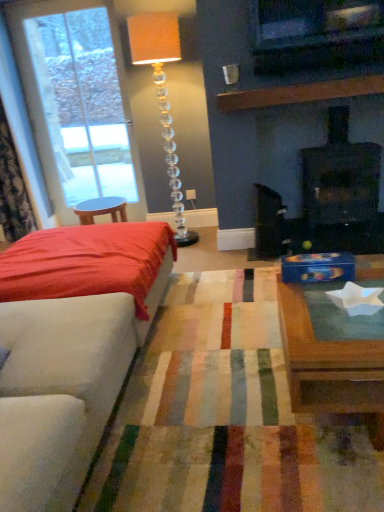
The image size is (384, 512). Describe the element at coordinates (162, 96) in the screenshot. I see `translucent crystal floor lamp at center` at that location.

I want to click on black matte fireplace at upper right, so click(x=340, y=176).

Who is smaller, black matte fireplace at upper right or wooden coffee table at center?

With smaller size is black matte fireplace at upper right.

From a real-world perspective, is black matte fireplace at upper right physically located above or below wooden coffee table at center?

black matte fireplace at upper right is above wooden coffee table at center.

Which is more to the right, black matte fireplace at upper right or wooden coffee table at center?

Positioned to the right is black matte fireplace at upper right.

Considering the positions of objects black matte fireplace at upper right and wooden coffee table at center in the image provided, who is in front, black matte fireplace at upper right or wooden coffee table at center?

Positioned in front is wooden coffee table at center.

Is point (53, 186) closer or farther from the camera than point (25, 115)?

Point (53, 186) is farther from the camera than point (25, 115).

From their relative heights in the image, would you say clear glass door at left is taller or shorter than velvet floral curtain at left?

Clearly, clear glass door at left is taller compared to velvet floral curtain at left.

The height and width of the screenshot is (512, 384). Find the location of `window above the velvet floral curtain at left (from a real-world perspective)`. window above the velvet floral curtain at left (from a real-world perspective) is located at coordinates (80, 102).

In terms of size, does clear glass door at left appear bigger or smaller than velvet floral curtain at left?

Considering their sizes, clear glass door at left takes up less space than velvet floral curtain at left.

Is clear glass door at left behind satin red bed at left?

Yes, clear glass door at left is behind satin red bed at left.

From the image's perspective, is clear glass door at left located above or below satin red bed at left?

Based on their image positions, clear glass door at left is located above satin red bed at left.

Considering the relative sizes of clear glass door at left and satin red bed at left in the image provided, is clear glass door at left taller than satin red bed at left?

Indeed, clear glass door at left has a greater height compared to satin red bed at left.

Is satin red bed at left far away from velvet floral curtain at left?

Yes, satin red bed at left is far from velvet floral curtain at left.

Between satin red bed at left and velvet floral curtain at left, which one is positioned behind?

velvet floral curtain at left.

Which is more distant, (145, 318) or (22, 115)?

The point (22, 115) is more distant.

From a real-world perspective, is satin red bed at left under velvet floral curtain at left?

Yes, from a real-world perspective, satin red bed at left is beneath velvet floral curtain at left.

Is point (208, 289) positioned in front of point (146, 327)?

No.

Which object is further away from the camera, wooden coffee table at center or satin red bed at left?

Positioned behind is satin red bed at left.

From the image's perspective, between wooden coffee table at center and satin red bed at left, which one is located above?

From the image's view, satin red bed at left is above.

Measure the distance between translucent crystal floor lamp at center and satin red bed at left.

They are 3.84 feet apart.

Considering the positions of point (192, 233) and point (2, 257), is point (192, 233) closer or farther from the camera than point (2, 257)?

Point (192, 233) is farther from the camera than point (2, 257).

Locate an element on the screen. The height and width of the screenshot is (512, 384). bed that appears on the left of translucent crystal floor lamp at center is located at coordinates (89, 263).

Can you confirm if translucent crystal floor lamp at center is thinner than satin red bed at left?

Yes.

From the image's perspective, who appears lower, translucent crystal floor lamp at center or velvet floral curtain at left?

From the image's view, translucent crystal floor lamp at center is below.

From a real-world perspective, is translucent crystal floor lamp at center on top of velvet floral curtain at left?

Actually, translucent crystal floor lamp at center is physically below velvet floral curtain at left in the real world.

Considering the relative positions of translucent crystal floor lamp at center and velvet floral curtain at left in the image provided, is translucent crystal floor lamp at center to the left or to the right of velvet floral curtain at left?

Clearly, translucent crystal floor lamp at center is on the right of velvet floral curtain at left in the image.

How different are the orientations of translucent crystal floor lamp at center and velvet floral curtain at left in degrees?

The facing directions of translucent crystal floor lamp at center and velvet floral curtain at left are 0.684 degrees apart.

The height and width of the screenshot is (512, 384). Identify the location of plain in front of the black matte fireplace at upper right. (225, 416).

The height and width of the screenshot is (512, 384). I want to click on curtain located underneath the clear glass door at left (from a real-world perspective), so tap(23, 133).

Looking at the image, which one is located further to translucent crystal floor lamp at center, satin red bed at left or velvet floral curtain at left?

Among the two, velvet floral curtain at left is located further to translucent crystal floor lamp at center.

When comparing their distances from velvet floral curtain at left, does wooden coffee table at center or translucent crystal floor lamp at center seem further?

The object further to velvet floral curtain at left is wooden coffee table at center.

Considering their positions, is velvet floral curtain at left positioned closer to wooden coffee table at center than satin red bed at left?

satin red bed at left.

Looking at the image, which one is located closer to velvet floral curtain at left, translucent crystal floor lamp at center or satin red bed at left?

translucent crystal floor lamp at center is positioned closer to the anchor velvet floral curtain at left.

In the scene shown: From the image, which object appears to be nearer to black matte fireplace at upper right, satin red bed at left or velvet floral curtain at left?

Based on the image, satin red bed at left appears to be nearer to black matte fireplace at upper right.

Which object lies nearer to the anchor point satin red bed at left, black matte fireplace at upper right or translucent crystal floor lamp at center?

The object closer to satin red bed at left is translucent crystal floor lamp at center.

Based on their spatial positions, is clear glass door at left or black matte fireplace at upper right closer to translucent crystal floor lamp at center?

clear glass door at left is positioned closer to the anchor translucent crystal floor lamp at center.

Looking at the image, which one is located further to clear glass door at left, wooden coffee table at center or velvet floral curtain at left?

Among the two, wooden coffee table at center is located further to clear glass door at left.

The width and height of the screenshot is (384, 512). I want to click on curtain between wooden coffee table at center and clear glass door at left along the z-axis, so click(x=23, y=133).

Where is `table lamp positioned between wooden coffee table at center and black matte fireplace at upper right from near to far`? The height and width of the screenshot is (512, 384). table lamp positioned between wooden coffee table at center and black matte fireplace at upper right from near to far is located at coordinates (162, 96).

In order to click on table lamp between satin red bed at left and clear glass door at left in the front-back direction in this screenshot , I will do `click(162, 96)`.

Where is `bed between velvet floral curtain at left and translucent crystal floor lamp at center in the horizontal direction`? bed between velvet floral curtain at left and translucent crystal floor lamp at center in the horizontal direction is located at coordinates (89, 263).